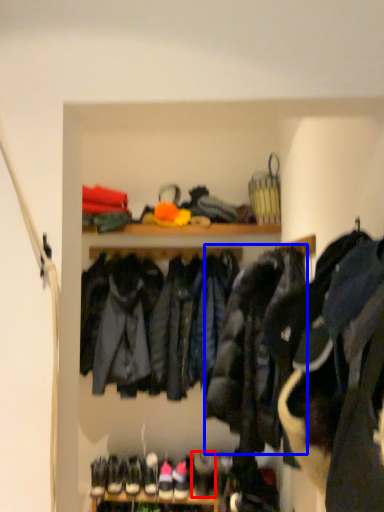
Question: Which of the following is the farthest to the observer, shoe (highlighted by a red box) or jacket (highlighted by a blue box)?

Choices:
 (A) shoe
 (B) jacket

Answer: (A)